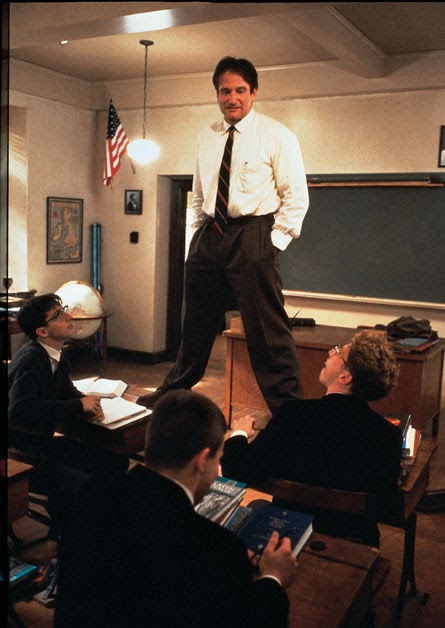
Find the location of a particular element. school desks is located at coordinates (418, 463), (130, 433), (23, 479), (337, 563).